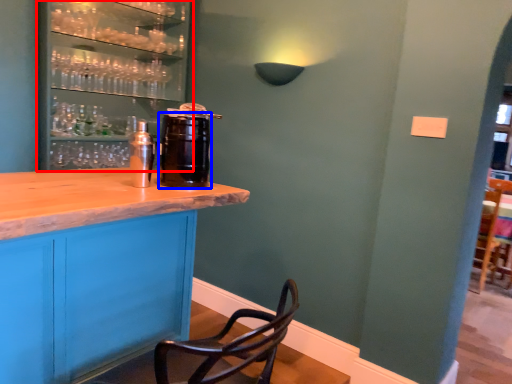
Question: Which object is closer to the camera taking this photo, shelf (highlighted by a red box) or beverage (highlighted by a blue box)?

Choices:
 (A) shelf
 (B) beverage

Answer: (B)